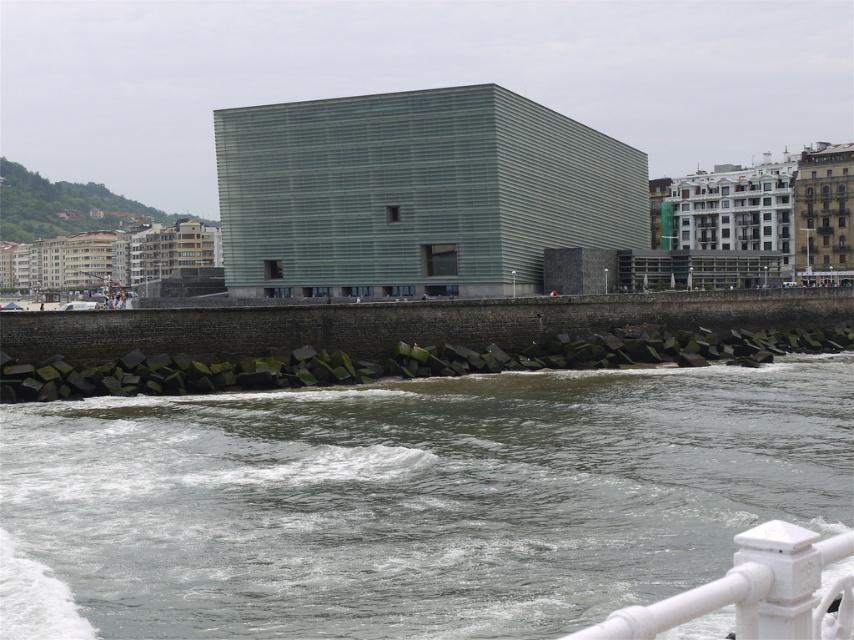
You are standing at the point closest to the building in the image. Which of the two points, point (x=341, y=422) or point (x=787, y=600), is farther away from you?

Point (x=341, y=422) is behind point (x=787, y=600), so it is farther away from you.

You are a maintenance worker tasked with ensuring safety around the waterfront structure. You notice two elements in the scene, the dark gray water at lower center and the white painted metal railing at lower right. Which of these two elements has a greater width?

The dark gray water at lower center has a greater width than the white painted metal railing at lower right according to the description provided.